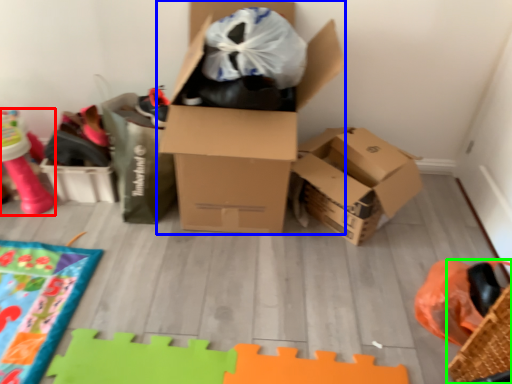
Question: Estimate the real-world distances between objects in this image. Which object is closer to toy (highlighted by a red box), box (highlighted by a blue box) or basket (highlighted by a green box)?

Choices:
 (A) box
 (B) basket

Answer: (A)